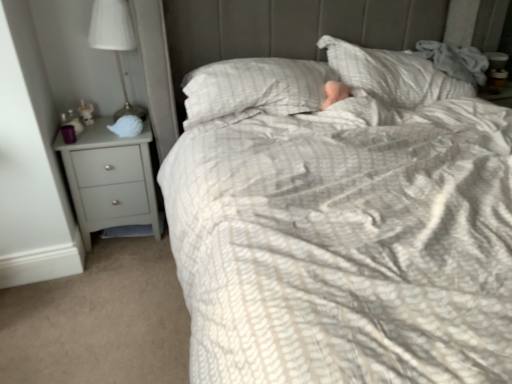
Question: From a real-world perspective, relative to white matte shell at left, is matte gray chest of drawers at left vertically above or below?

Choices:
 (A) above
 (B) below

Answer: (B)

Question: From their relative heights in the image, would you say matte gray chest of drawers at left is taller or shorter than white matte shell at left?

Choices:
 (A) tall
 (B) short

Answer: (A)

Question: Considering the real-world distances, which object is closest to the white matte shell at left?

Choices:
 (A) white fabric lampshade at left
 (B) matte gray chest of drawers at left

Answer: (B)

Question: Estimate the real-world distances between objects in this image. Which object is closer to the white fabric lampshade at left?

Choices:
 (A) white matte shell at left
 (B) matte gray chest of drawers at left

Answer: (A)